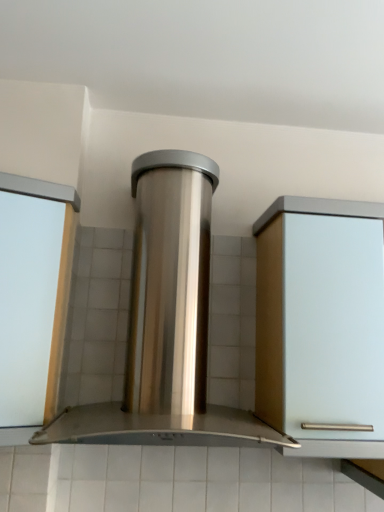
Question: Is white glossy door at left facing away from stainless steel range hood at center?

Choices:
 (A) yes
 (B) no

Answer: (B)

Question: Is the depth of white glossy door at left less than that of stainless steel range hood at center?

Choices:
 (A) yes
 (B) no

Answer: (B)

Question: Does white glossy door at left have a lesser height compared to stainless steel range hood at center?

Choices:
 (A) no
 (B) yes

Answer: (B)

Question: Is white glossy door at left thinner than stainless steel range hood at center?

Choices:
 (A) yes
 (B) no

Answer: (A)

Question: Would you say white glossy door at left is a long distance from stainless steel range hood at center?

Choices:
 (A) no
 (B) yes

Answer: (A)

Question: From a real-world perspective, is white glossy door at left positioned under stainless steel range hood at center based on gravity?

Choices:
 (A) yes
 (B) no

Answer: (A)

Question: From a real-world perspective, is stainless steel range hood at center located beneath white glossy door at left?

Choices:
 (A) yes
 (B) no

Answer: (B)

Question: Is stainless steel range hood at center shorter than white glossy door at left?

Choices:
 (A) yes
 (B) no

Answer: (B)

Question: Considering the relative positions of stainless steel range hood at center and white glossy door at left in the image provided, is stainless steel range hood at center to the right of white glossy door at left from the viewer's perspective?

Choices:
 (A) no
 (B) yes

Answer: (B)

Question: Is stainless steel range hood at center at the left side of white glossy door at left?

Choices:
 (A) yes
 (B) no

Answer: (B)

Question: Is stainless steel range hood at center wider than white glossy door at left?

Choices:
 (A) yes
 (B) no

Answer: (A)

Question: Is stainless steel range hood at center positioned in front of white glossy door at left?

Choices:
 (A) no
 (B) yes

Answer: (B)

Question: Based on their positions, is stainless steel range hood at center located to the left or right of white glossy door at left?

Choices:
 (A) right
 (B) left

Answer: (A)